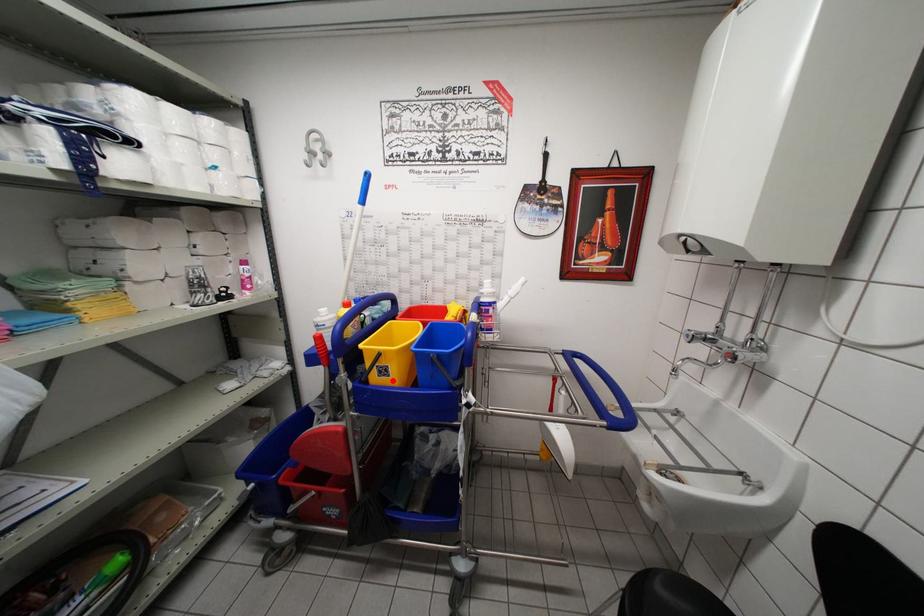
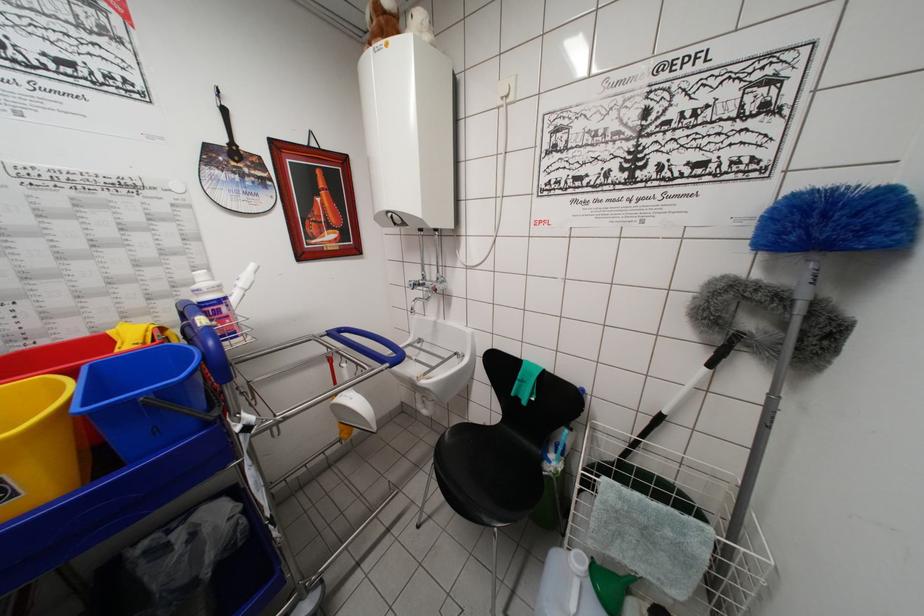
In the second image, find the point that corresponds to the highlighted location in the first image.

(20, 500)